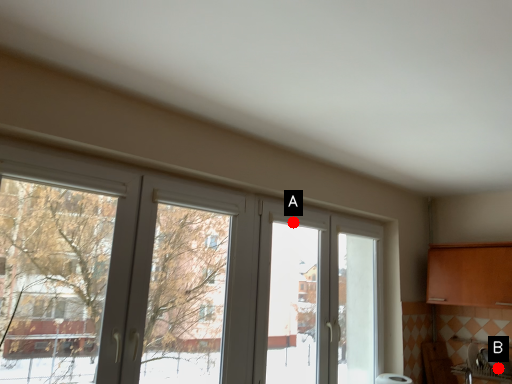
Question: Two points are circled on the image, labeled by A and B beside each circle. Which of the following is the closest to the observer?

Choices:
 (A) A is closer
 (B) B is closer

Answer: (A)